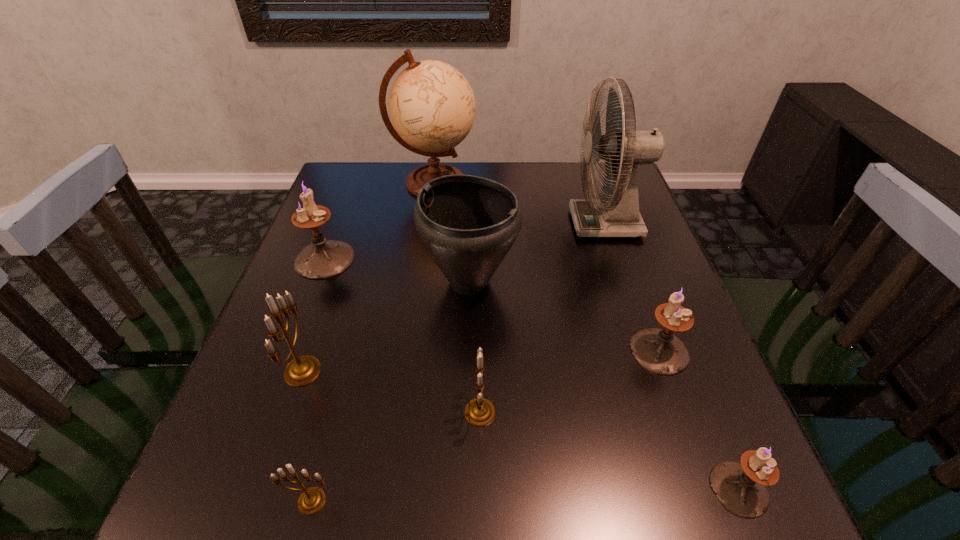
Locate an element on the screen. vacant space at the left edge of the desktop is located at coordinates (277, 322).

Identify the location of vacant space at the far left corner. (364, 165).

Find the location of a particular element. free space at the near left corner of the desktop is located at coordinates (207, 472).

The width and height of the screenshot is (960, 540). Find the location of `vacant area that lies between the farthest purple candle holder and the second smallest purple candle holder`. vacant area that lies between the farthest purple candle holder and the second smallest purple candle holder is located at coordinates point(492,305).

Where is `free spot between the fourth candle holder from right to left and the leftmost gold candelabrum`? This screenshot has width=960, height=540. free spot between the fourth candle holder from right to left and the leftmost gold candelabrum is located at coordinates (307, 436).

Locate an element on the screen. This screenshot has height=540, width=960. vacant area between the urn and the second nearest purple candle holder is located at coordinates (564, 316).

This screenshot has height=540, width=960. Identify the location of vacant region between the urn and the leftmost gold candelabrum. (386, 327).

Identify the location of empty space between the nearest gold candelabrum and the nearest purple candle holder. This screenshot has width=960, height=540. (525, 495).

Identify the location of free space between the second biggest purple candle holder and the urn. (564, 316).

The width and height of the screenshot is (960, 540). Identify the location of empty location between the globe and the biggest purple candle holder. (379, 221).